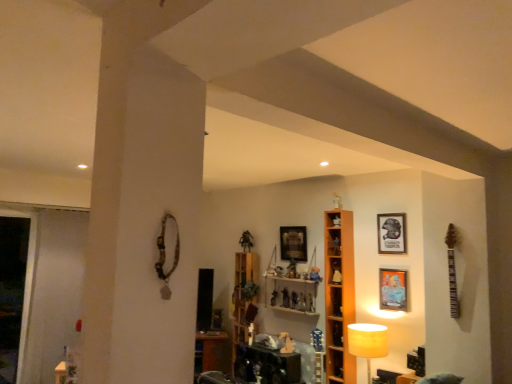
Question: Is matte plastic figurine at center, positioned as the 4th toy in left-to-right order, to the right of matte orange picture frame at upper right, placed as the second picture frame when sorted from left to right, from the viewer's perspective?

Choices:
 (A) yes
 (B) no

Answer: (B)

Question: Is matte plastic figurine at center, the 1th toy in the right-to-left sequence, looking in the opposite direction of matte orange picture frame at upper right, which is counted as the first picture frame, starting from the front?

Choices:
 (A) yes
 (B) no

Answer: (B)

Question: Are matte plastic figurine at center, the 1th toy in the right-to-left sequence, and matte orange picture frame at upper right, arranged as the third picture frame when viewed from the back, beside each other?

Choices:
 (A) yes
 (B) no

Answer: (B)

Question: From the image's perspective, would you say matte plastic figurine at center, positioned as the 4th toy in left-to-right order, is shown under matte orange picture frame at upper right, placed as the second picture frame when sorted from left to right?

Choices:
 (A) no
 (B) yes

Answer: (B)

Question: Is matte plastic figurine at center, positioned as the 4th toy in left-to-right order, closer to the viewer compared to matte orange picture frame at upper right, which is counted as the first picture frame, starting from the front?

Choices:
 (A) no
 (B) yes

Answer: (A)

Question: Can you confirm if matte plastic figurine at center, the 1th toy in the right-to-left sequence, is wider than matte orange picture frame at upper right, which is the second picture frame in right-to-left order?

Choices:
 (A) no
 (B) yes

Answer: (B)

Question: From a real-world perspective, is matte orange picture frame at upper right, which is the second picture frame in right-to-left order, beneath transparent glass door at left?

Choices:
 (A) yes
 (B) no

Answer: (B)

Question: From the image's perspective, does matte orange picture frame at upper right, arranged as the third picture frame when viewed from the back, appear lower than transparent glass door at left?

Choices:
 (A) no
 (B) yes

Answer: (A)

Question: From a real-world perspective, is matte orange picture frame at upper right, which is the second picture frame in right-to-left order, positioned over transparent glass door at left based on gravity?

Choices:
 (A) no
 (B) yes

Answer: (B)

Question: Considering the relative positions of matte orange picture frame at upper right, which is counted as the first picture frame, starting from the front, and transparent glass door at left in the image provided, is matte orange picture frame at upper right, which is counted as the first picture frame, starting from the front, to the left of transparent glass door at left from the viewer's perspective?

Choices:
 (A) yes
 (B) no

Answer: (B)

Question: Considering the relative sizes of matte orange picture frame at upper right, which is counted as the first picture frame, starting from the front, and transparent glass door at left in the image provided, is matte orange picture frame at upper right, which is counted as the first picture frame, starting from the front, smaller than transparent glass door at left?

Choices:
 (A) yes
 (B) no

Answer: (A)

Question: Is transparent glass door at left at the back of matte orange picture frame at upper right, which is the second picture frame in right-to-left order?

Choices:
 (A) yes
 (B) no

Answer: (B)

Question: From a real-world perspective, is matte plastic figurine at center, the 1th toy in the right-to-left sequence, physically below wooden picture frame at upper center, acting as the 3th picture frame starting from the right?

Choices:
 (A) yes
 (B) no

Answer: (A)